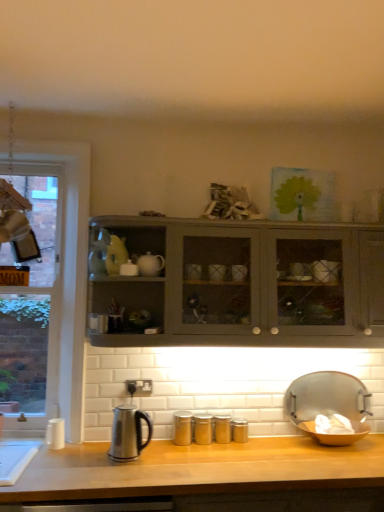
Question: From the image's perspective, is metallic silver tray at lower right located beneath clear glass window at left?

Choices:
 (A) yes
 (B) no

Answer: (A)

Question: Could you tell me if metallic silver tray at lower right is facing clear glass window at left?

Choices:
 (A) yes
 (B) no

Answer: (B)

Question: Is clear glass window at left a part of metallic silver tray at lower right?

Choices:
 (A) yes
 (B) no

Answer: (B)

Question: Is metallic silver tray at lower right outside of clear glass window at left?

Choices:
 (A) no
 (B) yes

Answer: (B)

Question: Considering the relative sizes of metallic silver tray at lower right and clear glass window at left in the image provided, is metallic silver tray at lower right shorter than clear glass window at left?

Choices:
 (A) no
 (B) yes

Answer: (B)

Question: From a real-world perspective, is wooden at center above or below stainless steel kettle at lower left?

Choices:
 (A) below
 (B) above

Answer: (A)

Question: Is wooden at center spatially inside stainless steel kettle at lower left, or outside of it?

Choices:
 (A) inside
 (B) outside

Answer: (B)

Question: Would you say wooden at center is to the left or to the right of stainless steel kettle at lower left in the picture?

Choices:
 (A) right
 (B) left

Answer: (A)

Question: In terms of height, does wooden at center look taller or shorter compared to stainless steel kettle at lower left?

Choices:
 (A) tall
 (B) short

Answer: (A)

Question: In the image, is metallic silver tray at lower right on the left side or the right side of wooden at center?

Choices:
 (A) right
 (B) left

Answer: (A)

Question: Does point (352, 395) appear closer or farther from the camera than point (29, 478)?

Choices:
 (A) closer
 (B) farther

Answer: (B)

Question: Is metallic silver tray at lower right inside the boundaries of wooden at center, or outside?

Choices:
 (A) inside
 (B) outside

Answer: (B)

Question: Is metallic silver tray at lower right in front of or behind wooden at center in the image?

Choices:
 (A) front
 (B) behind

Answer: (B)

Question: From a real-world perspective, relative to wooden at center, is matte gray cabinet at center vertically above or below?

Choices:
 (A) above
 (B) below

Answer: (A)

Question: Is matte gray cabinet at center bigger or smaller than wooden at center?

Choices:
 (A) small
 (B) big

Answer: (B)